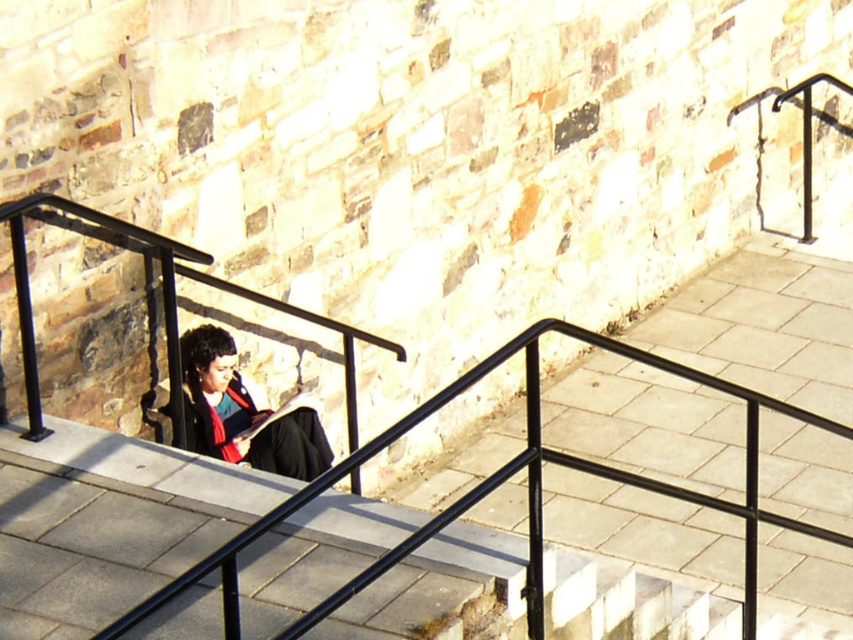
Is point (206, 568) less distant than point (285, 474)?

Yes, it is in front of point (285, 474).

What do you see at coordinates (502, 483) in the screenshot?
I see `black metal railing at center` at bounding box center [502, 483].

Locate an element on the screen. black metal railing at center is located at coordinates (502, 483).